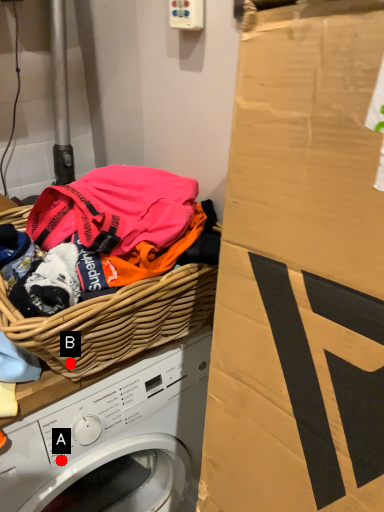
Question: Two points are circled on the image, labeled by A and B beside each circle. Which point is further to the camera?

Choices:
 (A) A is further
 (B) B is further

Answer: (A)